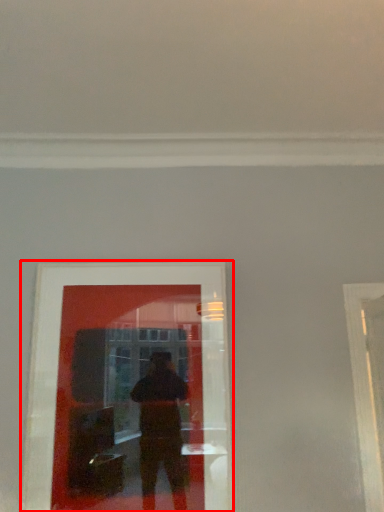
Question: From the image's perspective, what is the correct spatial positioning of picture frame (annotated by the red box) in reference to window frame?

Choices:
 (A) below
 (B) above

Answer: (B)